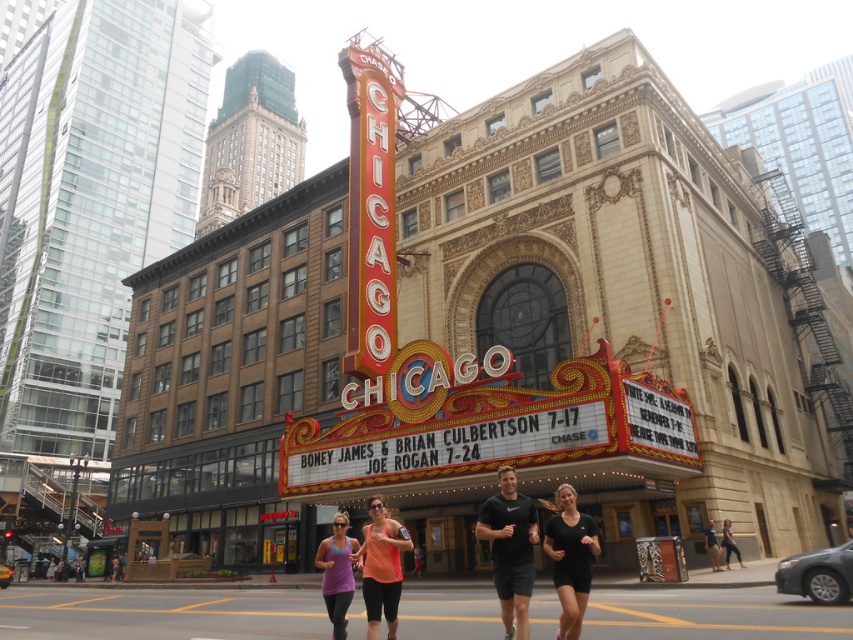
Who is more distant from viewer, (564, 605) or (369, 600)?

The point (369, 600) is behind.

Between black matte shorts at lower right and matte orange shirt at center, which one has less height?

black matte shorts at lower right is shorter.

You are a GUI agent. You are given a task and a screenshot of the screen. Output one action in this format:
    pyautogui.click(x=<x>, y=<y>)
    Task: Click on the black matte shorts at lower right
    This screenshot has width=853, height=640.
    Given the screenshot: What is the action you would take?
    pyautogui.click(x=570, y=557)

Can you confirm if black matte shirt at center is shorter than black fabric pants at lower right?

Incorrect, black matte shirt at center's height does not fall short of black fabric pants at lower right's.

Is point (502, 531) more distant than point (724, 554)?

No, (502, 531) is in front of (724, 554).

The height and width of the screenshot is (640, 853). Identify the location of black matte shirt at center. (509, 548).

Between black matte shirt at center and black athletic shorts at center, which one has more height?

With more height is black matte shirt at center.

Can you confirm if black matte shirt at center is taller than black athletic shorts at center?

Yes.

Who is more forward, (514, 525) or (718, 564)?

Point (514, 525) is in front.

Locate an element on the screen. black matte shirt at center is located at coordinates pyautogui.click(x=509, y=548).